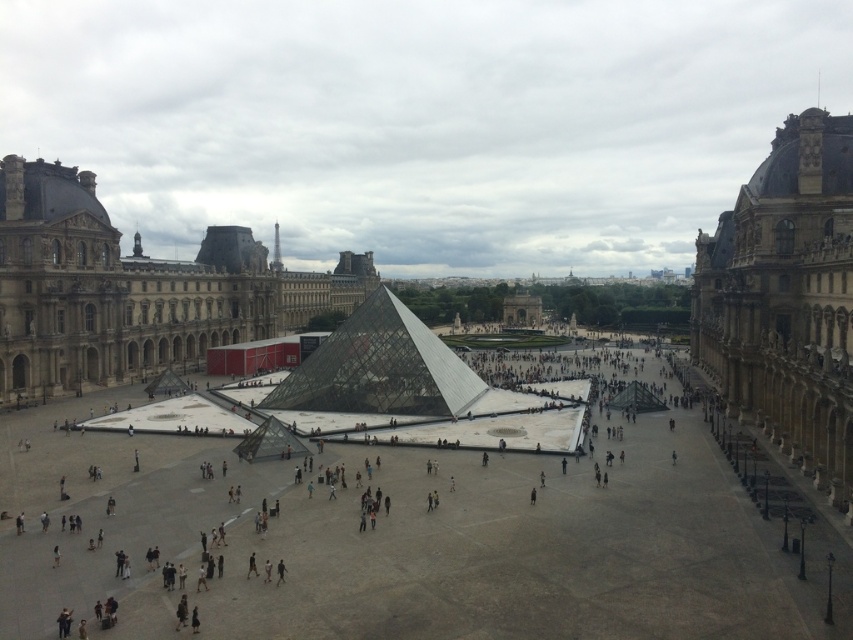
You are standing at the center of the Louvre Museum courtyard and looking towards the glass pyramid. Which direction should you turn to see the brown stone building at left?

You should turn to your left to see the brown stone building at left since it is located at point (x=134, y=289), which is to the left of the central glass pyramid.

You are standing in the courtyard of the Louvre Museum and want to take a photo of the brown stone building at left. If your camera has a maximum zoom range of 100 feet, will you be able to capture the entire building in your photo without moving closer?

The distance between you and the brown stone building at left is 367.39 feet, which exceeds your camera maximum zoom range of 100 feet. Therefore, you will not be able to capture the entire building in your photo without moving closer.

You are standing in the Louvre Museum courtyard and want to take a photo of both the glass pyramid and the classical buildings. You notice two points marked on the ground at coordinates point (235, 323) and point (746, 182). Which point should you stand closer to in order to have both the glass pyramid and the classical buildings in your frame?

You should stand closer to point (235, 323) because it is closer to the viewer than point (746, 182), allowing you to capture both the glass pyramid and the classical buildings in your photo.